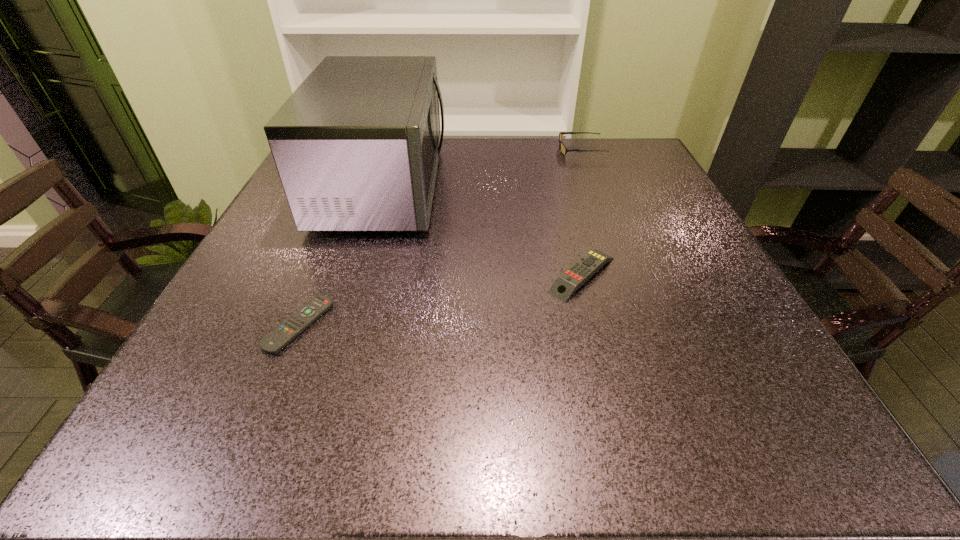
What are the coordinates of `vacant area that lies between the taller remote control and the shorter remote control` in the screenshot? It's located at (441, 300).

This screenshot has width=960, height=540. What are the coordinates of `empty location between the shorter remote control and the right remote control` in the screenshot? It's located at (441, 300).

The width and height of the screenshot is (960, 540). I want to click on unoccupied position between the microwave oven and the second tallest object, so click(481, 168).

The image size is (960, 540). What are the coordinates of `vacant area between the sunglasses and the tallest object` in the screenshot? It's located at (481, 168).

Choose which object is the second nearest neighbor to the tallest object. Please provide its 2D coordinates. Your answer should be formatted as a tuple, i.e. [(x, y)], where the tuple contains the x and y coordinates of a point satisfying the conditions above.

[(565, 285)]

Identify which object is located as the second nearest to the right remote control. Please provide its 2D coordinates. Your answer should be formatted as a tuple, i.e. [(x, y)], where the tuple contains the x and y coordinates of a point satisfying the conditions above.

[(300, 320)]

You are a GUI agent. You are given a task and a screenshot of the screen. Output one action in this format:
    pyautogui.click(x=<x>, y=<y>)
    Task: Click on the vacant space that satisfies the following two spatial constraints: 1. on the front-facing side of the sunglasses; 2. on the front side of the taller remote control
    
    Given the screenshot: What is the action you would take?
    pyautogui.click(x=627, y=275)

Locate an element on the screen. This screenshot has width=960, height=540. blank space that satisfies the following two spatial constraints: 1. on the front-facing side of the third tallest object; 2. on the right side of the microwave oven is located at coordinates (355, 275).

Find the location of a particular element. This screenshot has height=540, width=960. free space that satisfies the following two spatial constraints: 1. on the front-facing side of the tallest object; 2. on the back side of the right remote control is located at coordinates (355, 275).

Find the location of `free spot that satisfies the following two spatial constraints: 1. on the front-facing side of the tallest object; 2. on the front side of the shorter remote control`. free spot that satisfies the following two spatial constraints: 1. on the front-facing side of the tallest object; 2. on the front side of the shorter remote control is located at coordinates (339, 325).